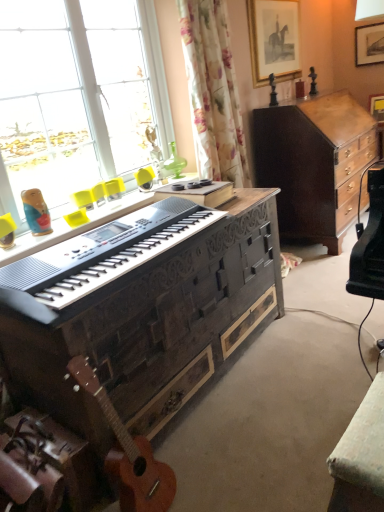
Locate an element on the screen. This screenshot has height=512, width=384. vacant area situated below wooden framed picture at upper right, the 2th picture frame in the right-to-left sequence (from a real-world perspective) is located at coordinates (279, 98).